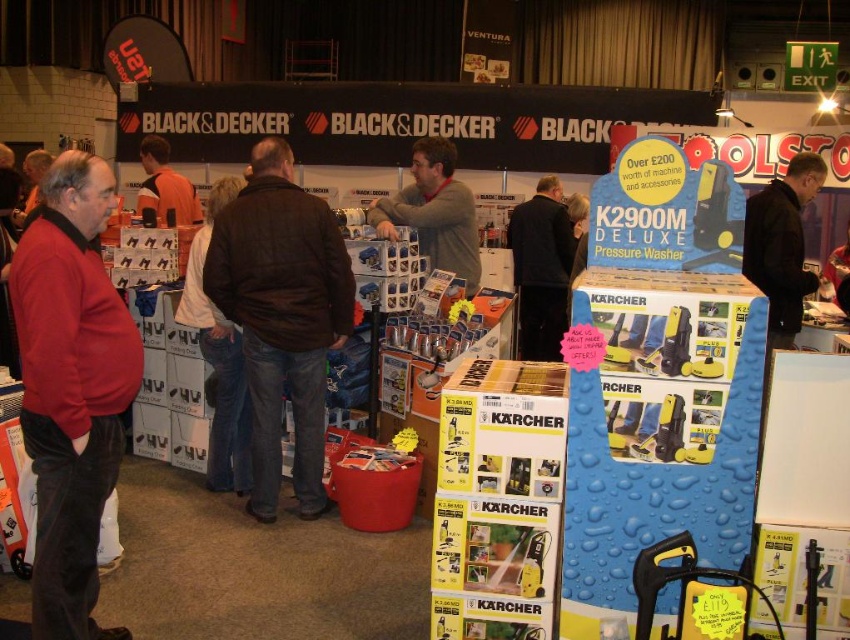
Question: Can you confirm if red sweater at left is positioned to the left of dark gray jacket at center?

Choices:
 (A) no
 (B) yes

Answer: (B)

Question: Which point is farther to the camera?

Choices:
 (A) brown quilted jacket at center
 (B) black matte jacket at upper right
 (C) dark gray jacket at center
 (D) orange fabric shirt at center

Answer: (C)

Question: Which point is closer to the camera taking this photo?

Choices:
 (A) (791, 260)
 (B) (82, 476)
 (C) (185, 193)
 (D) (451, 141)

Answer: (B)

Question: Which point appears farthest from the camera in this image?

Choices:
 (A) (790, 232)
 (B) (519, 291)

Answer: (B)

Question: Is red sweater at left bigger than brown quilted jacket at center?

Choices:
 (A) no
 (B) yes

Answer: (A)

Question: Is brown quilted jacket at center to the right of dark gray jacket at center from the viewer's perspective?

Choices:
 (A) no
 (B) yes

Answer: (A)